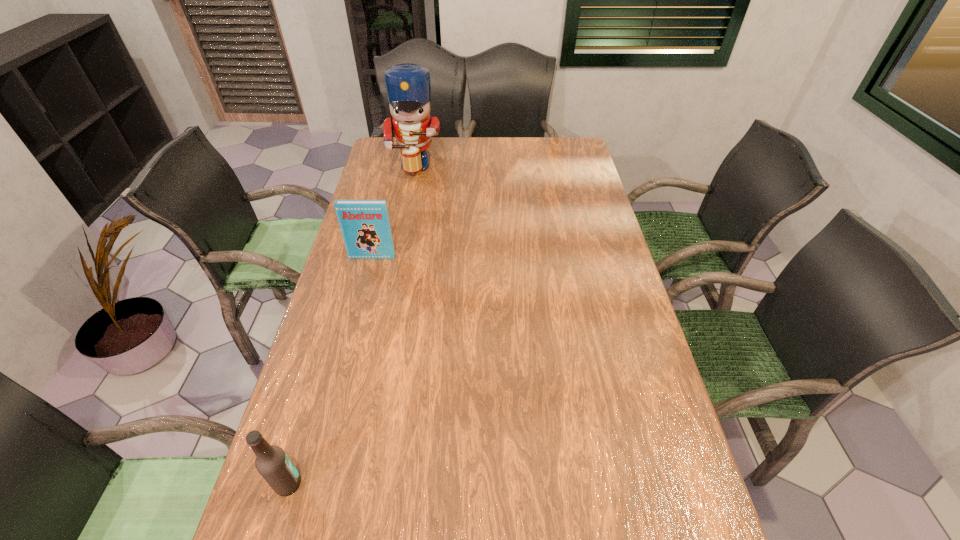
Locate an element on the screen. This screenshot has width=960, height=540. beer bottle situated at the left edge is located at coordinates [x=272, y=463].

Find the location of a particular element. object present at the far left corner is located at coordinates (408, 86).

Locate an element on the screen. vacant region at the far edge of the desktop is located at coordinates pyautogui.click(x=529, y=139).

Identify the location of vacant space at the left edge of the desktop. The width and height of the screenshot is (960, 540). (344, 367).

The width and height of the screenshot is (960, 540). I want to click on vacant space at the right edge of the desktop, so click(666, 499).

In the image, there is a desktop. Where is `vacant space at the far right corner`? Image resolution: width=960 pixels, height=540 pixels. vacant space at the far right corner is located at coordinates (567, 145).

I want to click on free space between the beer bottle and the second farthest object, so click(x=330, y=370).

Identify the location of vacant area that lies between the farthest object and the nearest object. (348, 324).

Locate an element on the screen. free space between the beer bottle and the second farthest object is located at coordinates (330, 370).

I want to click on empty space between the second nearest object and the beer bottle, so click(x=330, y=370).